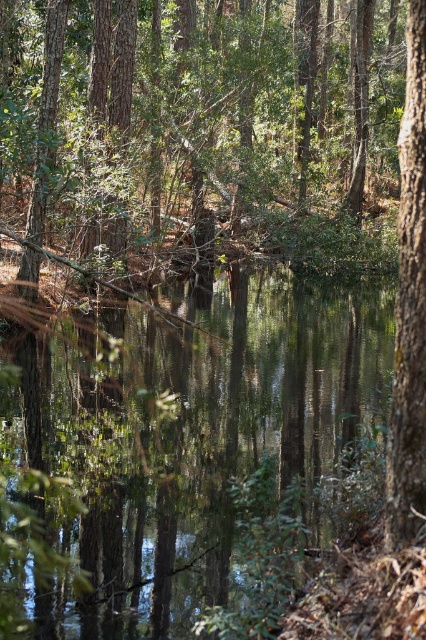
Question: Is brown rough tree at center smaller than clear water at center?

Choices:
 (A) yes
 (B) no

Answer: (B)

Question: Is the position of brown rough tree at center less distant than that of smooth bark tree at right?

Choices:
 (A) no
 (B) yes

Answer: (B)

Question: Which of the following is the closest to the observer?

Choices:
 (A) (108, 435)
 (B) (414, 371)
 (C) (23, 54)

Answer: (B)

Question: Does brown rough tree at center come behind clear water at center?

Choices:
 (A) no
 (B) yes

Answer: (A)

Question: Which of the following is the farthest from the observer?

Choices:
 (A) (422, 307)
 (B) (14, 13)
 (C) (224, 572)

Answer: (B)

Question: Which point appears closest to the camera in this image?

Choices:
 (A) (293, 356)
 (B) (75, 68)

Answer: (A)